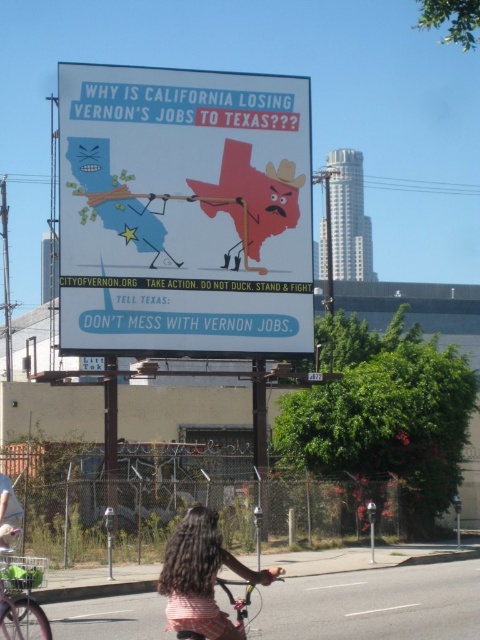
Question: Can you confirm if long curly hair at lower center is positioned to the right of white plastic parking meter at lower right?

Choices:
 (A) yes
 (B) no

Answer: (B)

Question: Considering the relative positions of matte blue paper at center and long curly hair at lower center in the image provided, where is matte blue paper at center located with respect to long curly hair at lower center?

Choices:
 (A) above
 (B) below

Answer: (A)

Question: Is green matte bicycle at lower left thinner than long curly hair at lower center?

Choices:
 (A) yes
 (B) no

Answer: (A)

Question: Estimate the real-world distances between objects in this image. Which object is closer to the matte blue paper at center?

Choices:
 (A) green matte bicycle at lower left
 (B) plaid fabric shirt at center
 (C) white plastic parking meter at lower right

Answer: (C)

Question: Which of the following is the closest to the observer?

Choices:
 (A) plaid fabric shirt at center
 (B) long curly hair at lower center

Answer: (A)

Question: Which object is the closest to the long curly hair at lower center?

Choices:
 (A) matte blue paper at center
 (B) white plastic parking meter at lower right
 (C) plaid fabric shirt at center
 (D) metallic silver bicycle at lower center

Answer: (D)